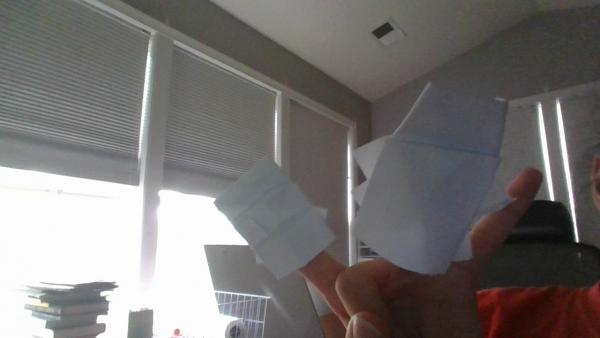
Locate an element on the screen. The height and width of the screenshot is (338, 600). vent in ceiling is located at coordinates (383, 35).